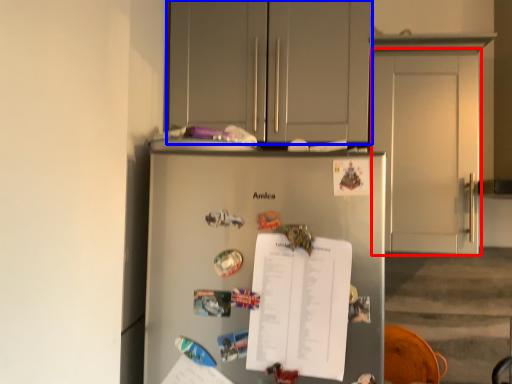
Question: Which object is further to the camera taking this photo, door (highlighted by a red box) or cabinetry (highlighted by a blue box)?

Choices:
 (A) door
 (B) cabinetry

Answer: (B)